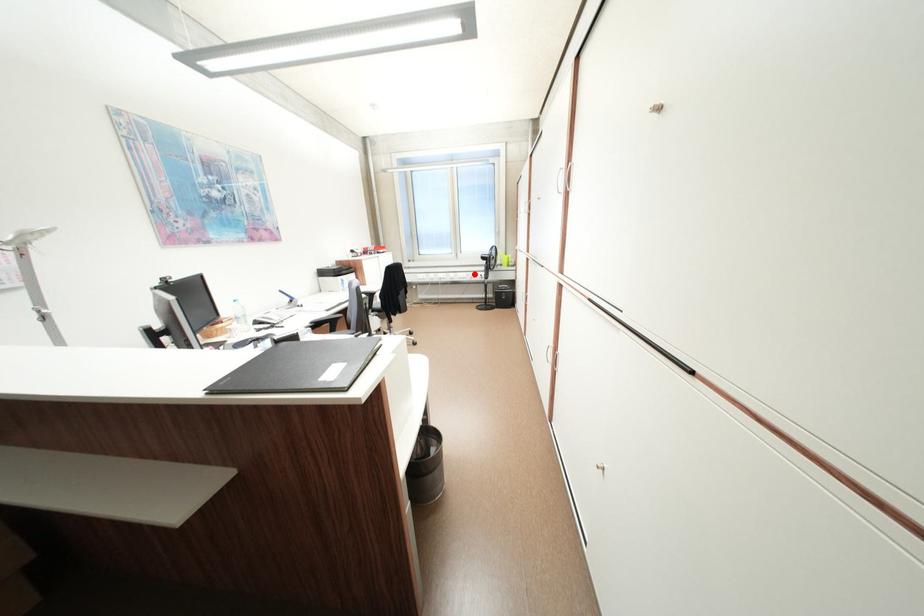
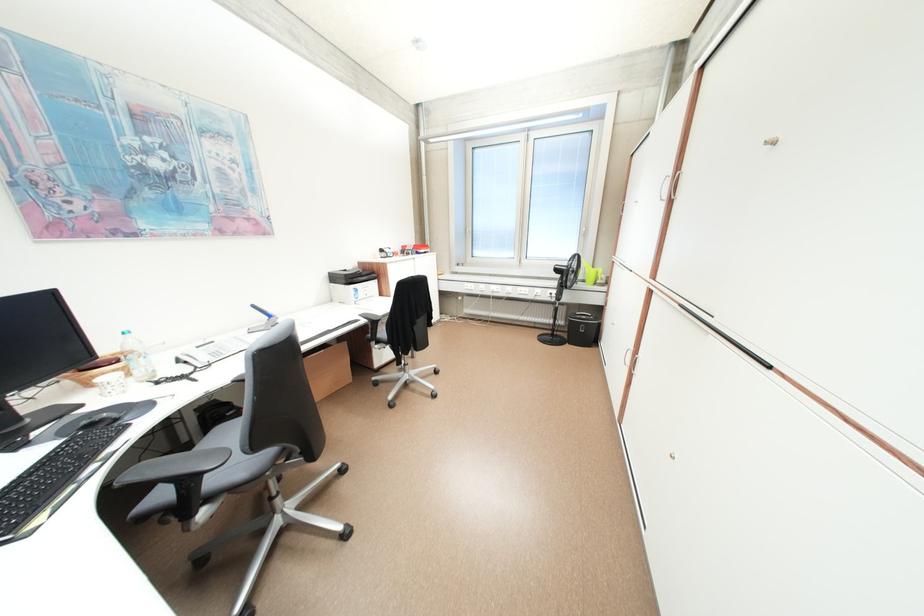
Where in the second image is the point corresponding to the highlighted location from the first image?

(537, 290)